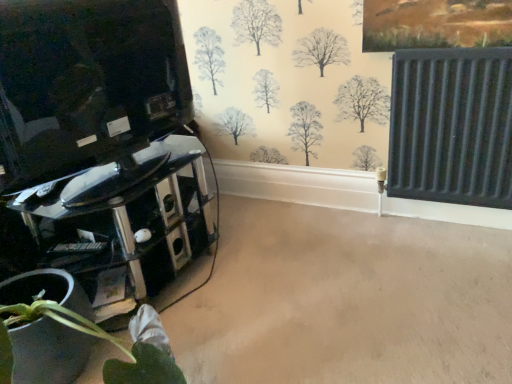
At what (x,y) coordinates should I click in order to perform the action: click on glossy black tv stand at left. Please return your answer as a coordinate pair (x, y). The image size is (512, 384). Looking at the image, I should click on (131, 230).

The height and width of the screenshot is (384, 512). What do you see at coordinates (131, 230) in the screenshot?
I see `glossy black tv stand at left` at bounding box center [131, 230].

Locate an element on the screen. glossy black tv stand at left is located at coordinates (131, 230).